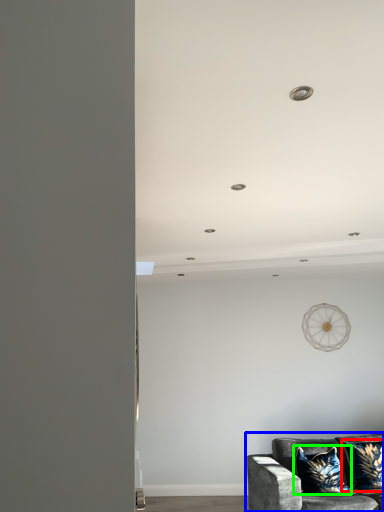
Question: Considering the real-world distances, which object is closest to pillow (highlighted by a red box)? studio couch (highlighted by a blue box) or pillow (highlighted by a green box).

Choices:
 (A) studio couch
 (B) pillow

Answer: (B)